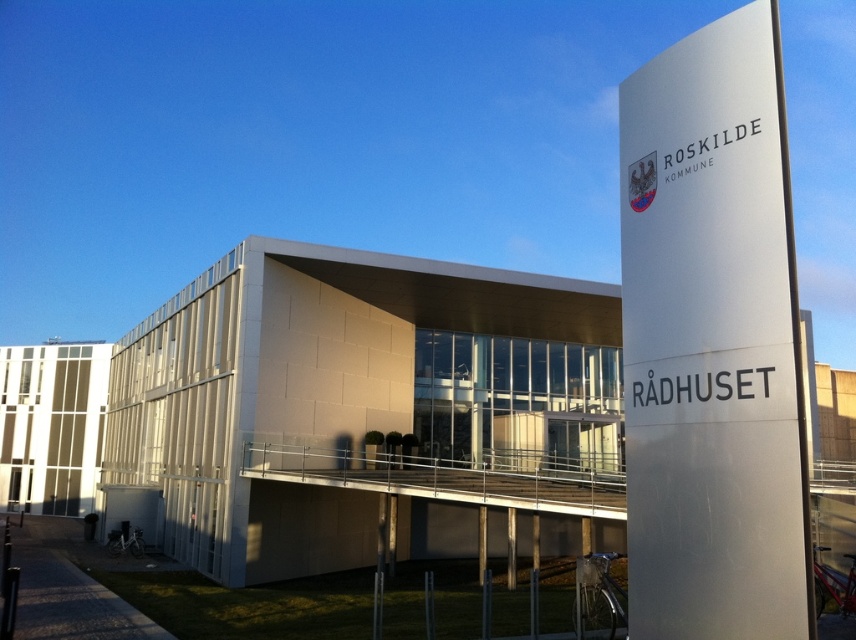
Question: Which point is farther to the camera?

Choices:
 (A) (521, 464)
 (B) (635, 84)

Answer: (A)

Question: Is white textured building at center positioned at the back of satin silver sign at right?

Choices:
 (A) no
 (B) yes

Answer: (B)

Question: Among these points, which one is farthest from the camera?

Choices:
 (A) (274, 296)
 (B) (664, 403)

Answer: (A)

Question: Among these points, which one is farthest from the camera?

Choices:
 (A) (311, 401)
 (B) (729, 179)

Answer: (A)

Question: Can you confirm if white textured building at center is wider than satin silver sign at right?

Choices:
 (A) yes
 (B) no

Answer: (A)

Question: Does white textured building at center appear over satin silver sign at right?

Choices:
 (A) no
 (B) yes

Answer: (A)